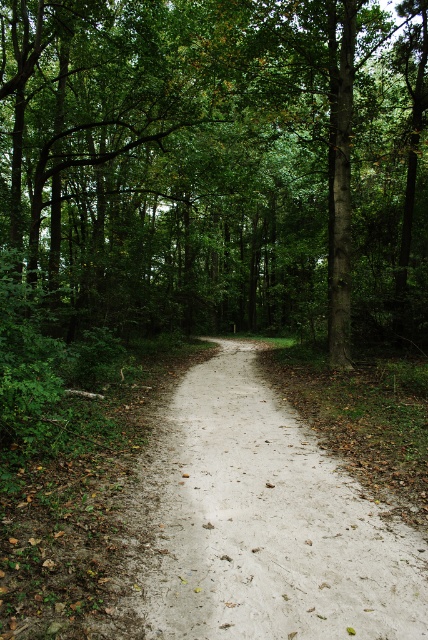
Question: In this image, where is green leafy tree at center located relative to sandy path at center?

Choices:
 (A) below
 (B) above

Answer: (B)

Question: Can you confirm if green leafy tree at center is positioned to the left of sandy path at center?

Choices:
 (A) yes
 (B) no

Answer: (A)

Question: Which point is closer to the camera?

Choices:
 (A) green leafy tree at center
 (B) sandy path at center

Answer: (B)

Question: Does green leafy tree at center appear on the right side of sandy path at center?

Choices:
 (A) no
 (B) yes

Answer: (A)